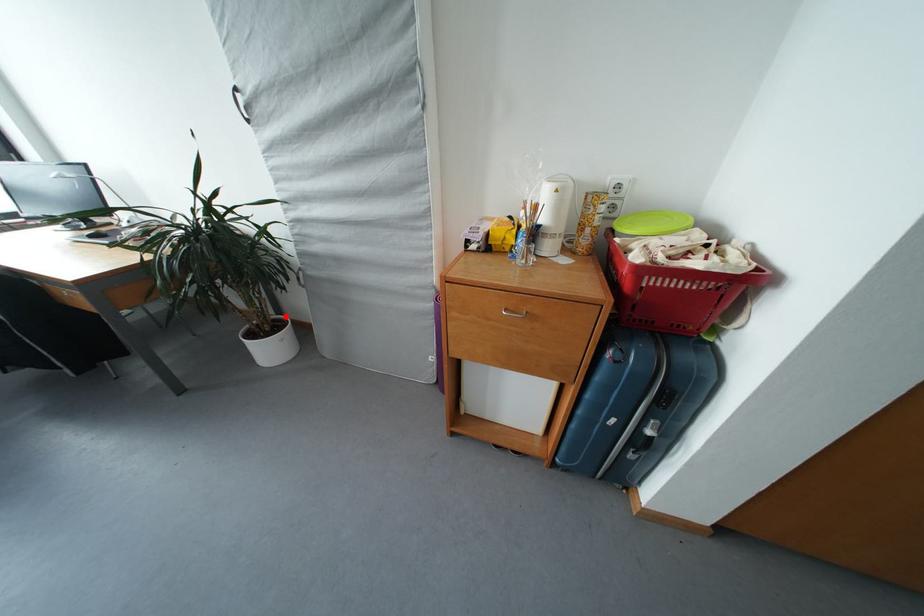
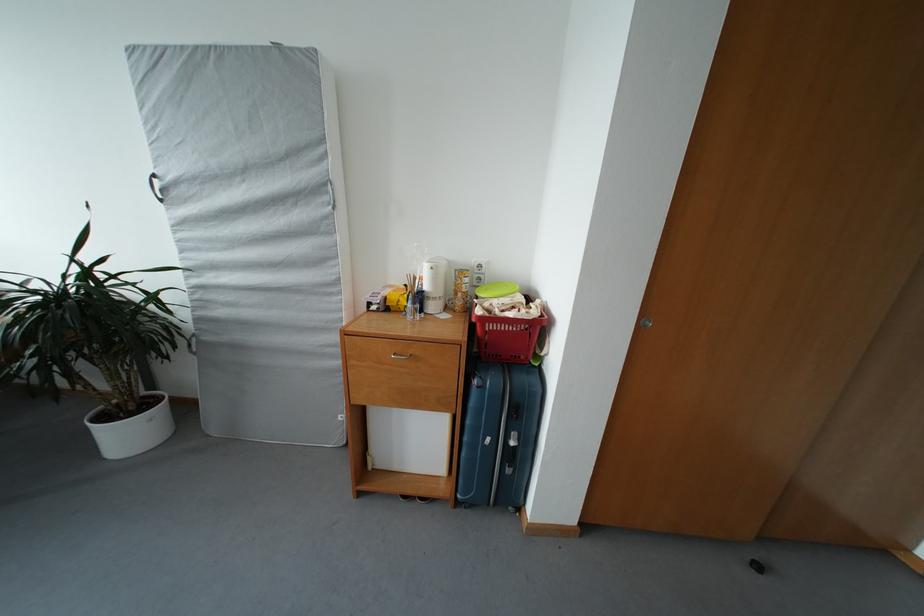
Question: I am providing you with two images of the same scene from different viewpoints. Given a red point in image1, look at the same physical point in image2. Is it:

Choices:
 (A) Closer to the viewpoint
 (B) Farther from the viewpoint

Answer: (B)